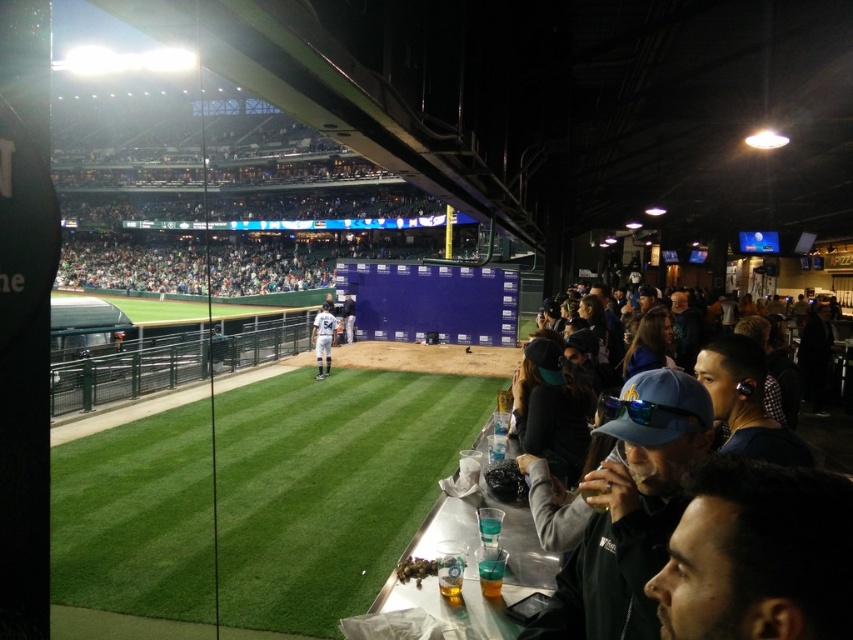
Question: Does dark blue jersey at right have a smaller size compared to white jersey at center?

Choices:
 (A) no
 (B) yes

Answer: (A)

Question: In this image, where is dark blue jersey at right located relative to white uniform at center?

Choices:
 (A) right
 (B) left

Answer: (A)

Question: Can you confirm if green artificial turf at center is positioned above white jersey at center?

Choices:
 (A) no
 (B) yes

Answer: (A)

Question: Which point is farther to the camera?

Choices:
 (A) (322, 369)
 (B) (665, 509)
 (C) (350, 317)

Answer: (C)

Question: Which point is closer to the camera?

Choices:
 (A) white jersey at center
 (B) green artificial turf at center

Answer: (B)

Question: Which object is the closest to the dark blue jersey at right?

Choices:
 (A) white uniform at center
 (B) white jersey at center
 (C) green artificial turf at center

Answer: (C)